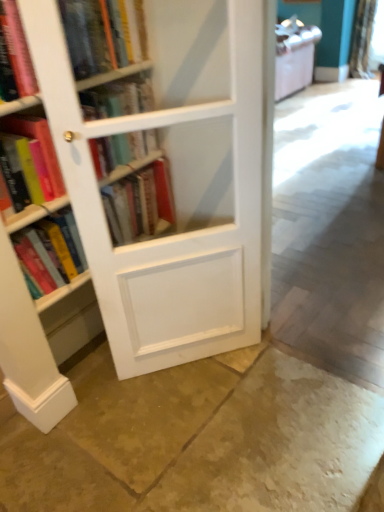
Image resolution: width=384 pixels, height=512 pixels. Identify the location of space that is in front of white wood bookcase at left. (195, 426).